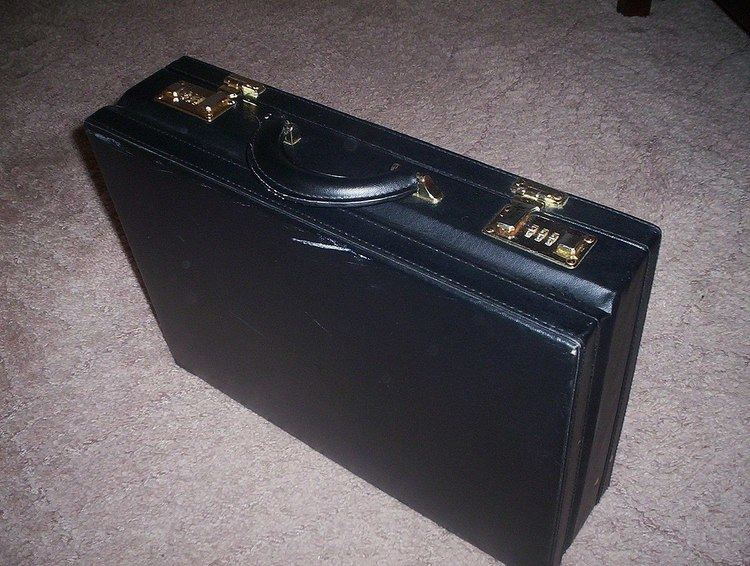
Where is `wooden leg of a furniture piece`? The height and width of the screenshot is (566, 750). wooden leg of a furniture piece is located at coordinates (631, 8).